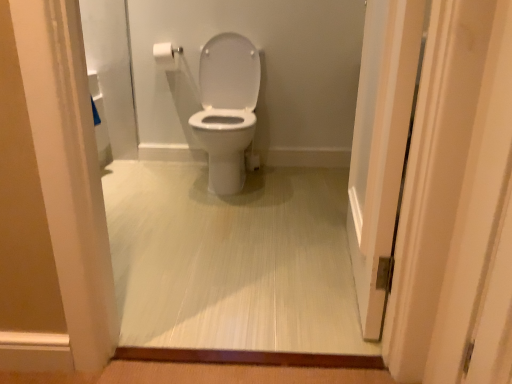
Where is `vacant space positioned to the left of white glossy door at right`? vacant space positioned to the left of white glossy door at right is located at coordinates (256, 268).